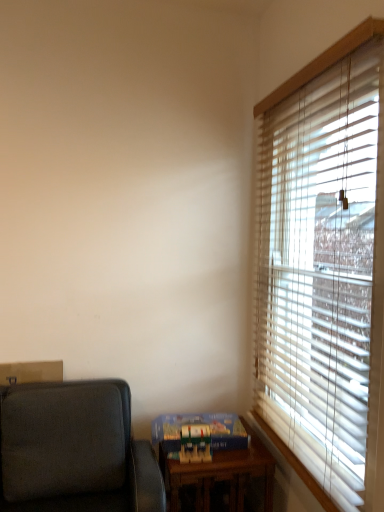
Question: Which direction should I rotate to look at blue cardboard game set at lower center, the second paperback book viewed from the front?

Choices:
 (A) right
 (B) left

Answer: (A)

Question: Could wooden blinds at right be considered to be inside blue cardboard game set at lower center, marked as the first paperback book in a back-to-front arrangement?

Choices:
 (A) no
 (B) yes

Answer: (A)

Question: From a real-world perspective, is blue cardboard game set at lower center, marked as the first paperback book in a back-to-front arrangement, under wooden blinds at right?

Choices:
 (A) yes
 (B) no

Answer: (A)

Question: From a real-world perspective, is blue cardboard game set at lower center, the second paperback book viewed from the front, on wooden blinds at right?

Choices:
 (A) yes
 (B) no

Answer: (B)

Question: Can you confirm if blue cardboard game set at lower center, marked as the first paperback book in a back-to-front arrangement, is smaller than wooden blinds at right?

Choices:
 (A) no
 (B) yes

Answer: (B)

Question: Is the surface of blue cardboard game set at lower center, marked as the first paperback book in a back-to-front arrangement, in direct contact with wooden blinds at right?

Choices:
 (A) no
 (B) yes

Answer: (A)

Question: Does blue cardboard game set at lower center, marked as the first paperback book in a back-to-front arrangement, turn towards wooden blinds at right?

Choices:
 (A) no
 (B) yes

Answer: (A)

Question: From the image's perspective, is dark gray fabric studio couch at lower left on top of wooden table at lower center?

Choices:
 (A) yes
 (B) no

Answer: (A)

Question: Does dark gray fabric studio couch at lower left have a greater height compared to wooden table at lower center?

Choices:
 (A) no
 (B) yes

Answer: (A)

Question: Is dark gray fabric studio couch at lower left shorter than wooden table at lower center?

Choices:
 (A) yes
 (B) no

Answer: (A)

Question: Can you confirm if dark gray fabric studio couch at lower left is positioned to the right of wooden table at lower center?

Choices:
 (A) yes
 (B) no

Answer: (B)

Question: Can you confirm if dark gray fabric studio couch at lower left is bigger than wooden table at lower center?

Choices:
 (A) yes
 (B) no

Answer: (B)

Question: Are dark gray fabric studio couch at lower left and wooden table at lower center far apart?

Choices:
 (A) yes
 (B) no

Answer: (B)

Question: Considering the relative sizes of blue cardboard game set at lower center, the second paperback book viewed from the front, and hardcover book at lower right, the 1th paperback book viewed from the front, in the image provided, is blue cardboard game set at lower center, the second paperback book viewed from the front, shorter than hardcover book at lower right, the 1th paperback book viewed from the front,?

Choices:
 (A) no
 (B) yes

Answer: (B)